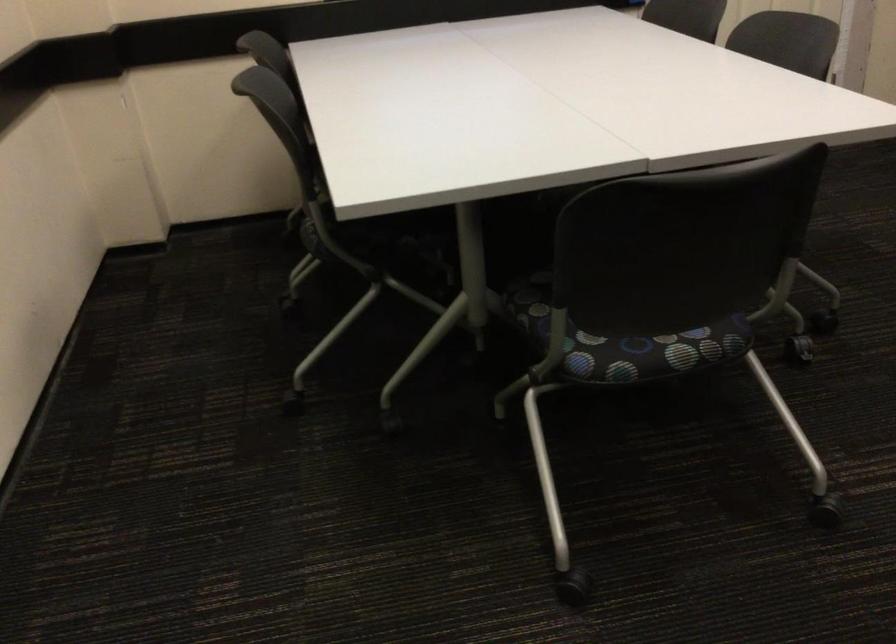
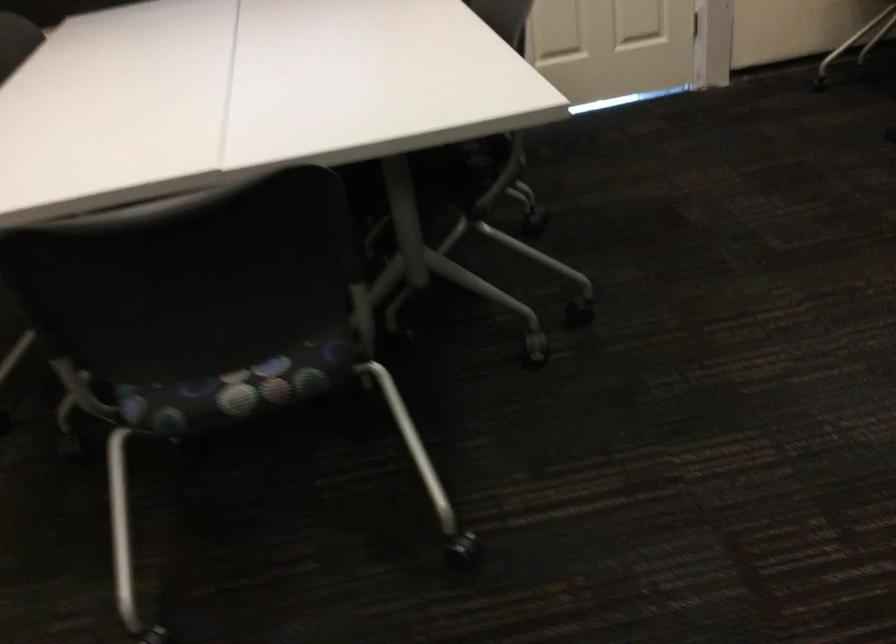
Question: Which direction would the cameraman need to move to produce the second image? Reply with the corresponding letter.

Choices:
 (A) Left
 (B) Right
 (C) Forward
 (D) Backward

Answer: (B)